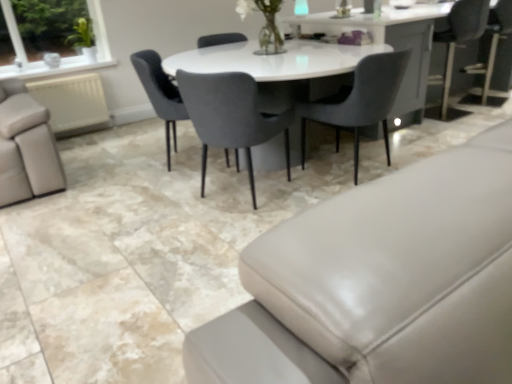
Question: In which direction should I rotate to look at matte gray chair at center, which is counted as the 3th chair, starting from the right?

Choices:
 (A) left
 (B) right

Answer: (A)

Question: Is velvet grey chair at center, marked as the 2th chair in a right-to-left arrangement, positioned with its back to matte gray chair at center, which is counted as the 3th chair, starting from the right?

Choices:
 (A) yes
 (B) no

Answer: (B)

Question: Does velvet grey chair at center, acting as the second chair starting from the left, have a lesser width compared to matte gray chair at center, which is counted as the 3th chair, starting from the right?

Choices:
 (A) yes
 (B) no

Answer: (B)

Question: Does velvet grey chair at center, marked as the 2th chair in a right-to-left arrangement, lie in front of matte gray chair at center, which appears as the first chair when viewed from the left?

Choices:
 (A) no
 (B) yes

Answer: (B)

Question: Is velvet grey chair at center, acting as the second chair starting from the left, smaller than matte gray chair at center, which appears as the first chair when viewed from the left?

Choices:
 (A) no
 (B) yes

Answer: (A)

Question: Is velvet grey chair at center, marked as the 2th chair in a right-to-left arrangement, further to the viewer compared to matte gray chair at center, which is counted as the 3th chair, starting from the right?

Choices:
 (A) yes
 (B) no

Answer: (B)

Question: Can you confirm if velvet grey chair at center, marked as the 2th chair in a right-to-left arrangement, is positioned to the left of matte gray chair at center, which is counted as the 3th chair, starting from the right?

Choices:
 (A) no
 (B) yes

Answer: (A)

Question: Does clear glass vase at upper center have a lesser height compared to matte gray couch at lower right?

Choices:
 (A) yes
 (B) no

Answer: (B)

Question: Considering the relative sizes of clear glass vase at upper center and matte gray couch at lower right in the image provided, is clear glass vase at upper center wider than matte gray couch at lower right?

Choices:
 (A) no
 (B) yes

Answer: (A)

Question: From the image's perspective, is clear glass vase at upper center located beneath matte gray couch at lower right?

Choices:
 (A) no
 (B) yes

Answer: (A)

Question: Does clear glass vase at upper center have a lesser width compared to matte gray couch at lower right?

Choices:
 (A) no
 (B) yes

Answer: (B)

Question: Considering the relative sizes of clear glass vase at upper center and matte gray couch at lower right in the image provided, is clear glass vase at upper center smaller than matte gray couch at lower right?

Choices:
 (A) no
 (B) yes

Answer: (B)

Question: Is clear glass vase at upper center in front of matte gray couch at lower right?

Choices:
 (A) yes
 (B) no

Answer: (B)

Question: From the image's perspective, is matte gray chair at center, which is counted as the 3th chair, starting from the right, over velvet grey chair at center, which is the first chair in right-to-left order?

Choices:
 (A) yes
 (B) no

Answer: (A)